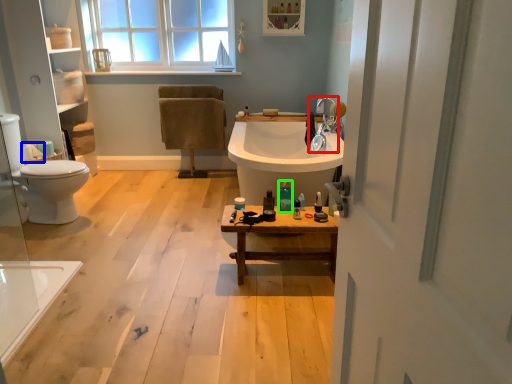
Question: Estimate the real-world distances between objects in this image. Which object is farther from tap (highlighted by a red box), toilet paper (highlighted by a blue box) or toiletry (highlighted by a green box)?

Choices:
 (A) toilet paper
 (B) toiletry

Answer: (A)